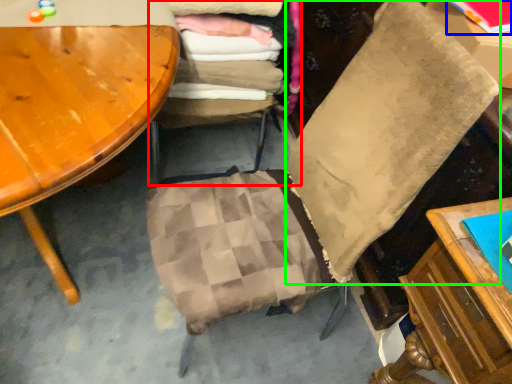
Question: Which object is the farthest from chair (highlighted by a red box)? Choose among these: book (highlighted by a blue box) or pillow (highlighted by a green box).

Choices:
 (A) book
 (B) pillow

Answer: (A)